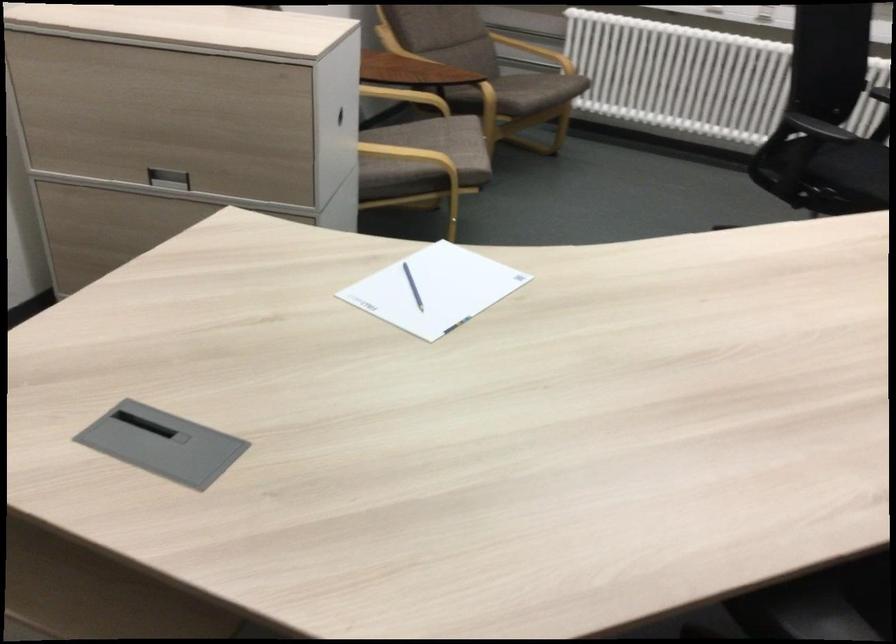
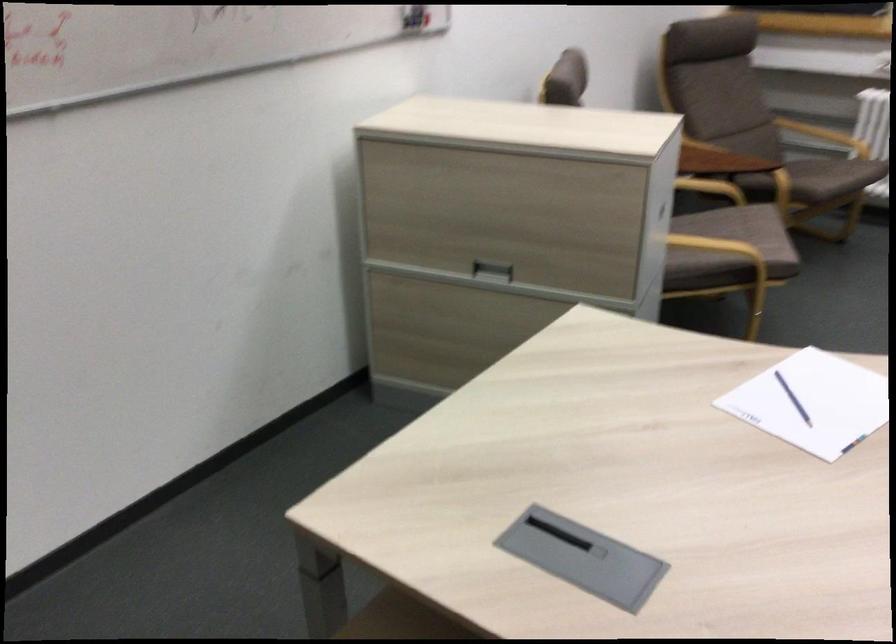
Question: What movement of the cameraman would produce the second image?

Choices:
 (A) Left
 (B) Right
 (C) Forward
 (D) Backward

Answer: (A)